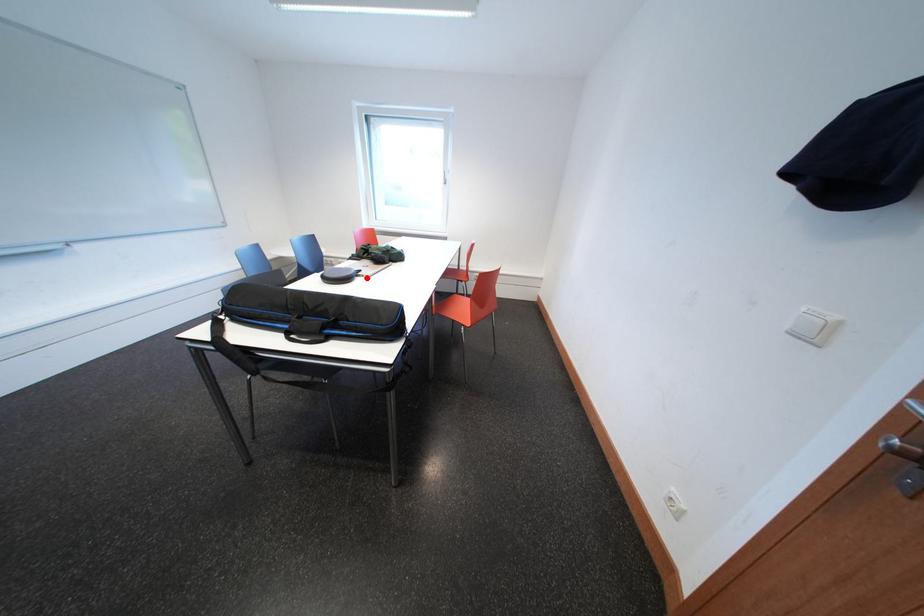
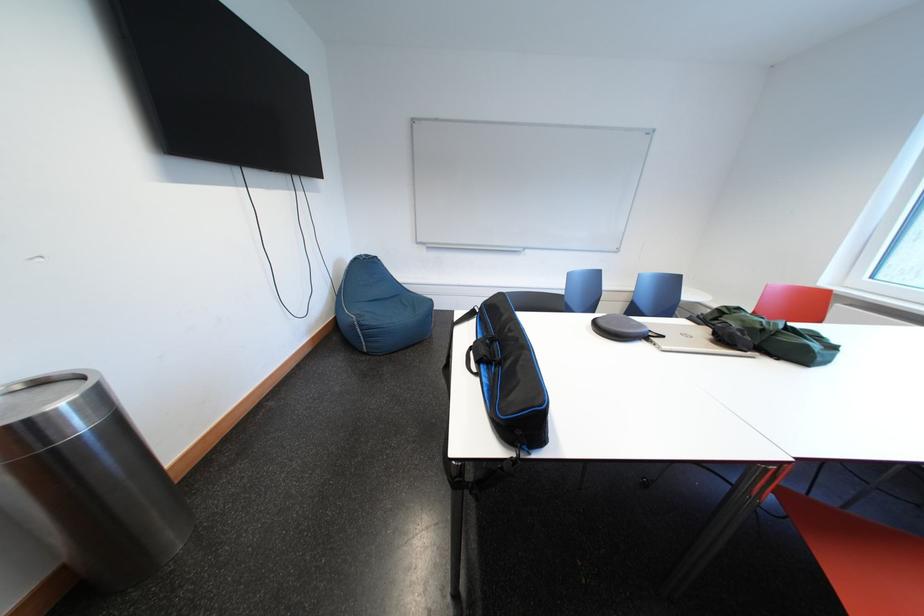
Locate, in the second image, the point that corresponds to the highlighted location in the first image.

(657, 341)